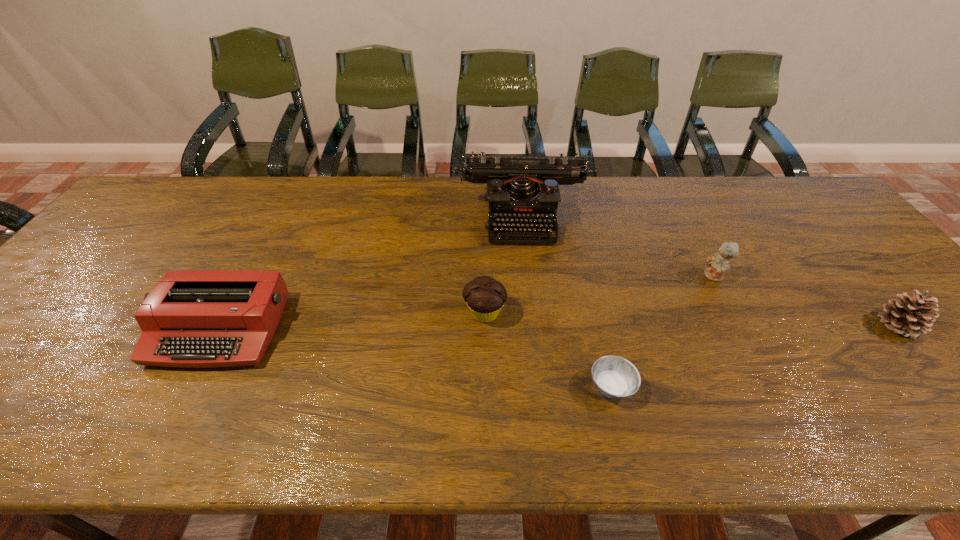
Find the location of a particular element. The width and height of the screenshot is (960, 540). the tallest object is located at coordinates (524, 190).

Locate an element on the screen. The image size is (960, 540). the taller typewriter is located at coordinates (524, 190).

Identify the location of the second farthest object. This screenshot has height=540, width=960. (718, 263).

Image resolution: width=960 pixels, height=540 pixels. I want to click on the fifth object from left to right, so click(x=718, y=263).

The image size is (960, 540). I want to click on pinecone, so click(x=910, y=316).

This screenshot has height=540, width=960. Find the location of `muffin`. muffin is located at coordinates (485, 296).

Find the location of `the nearer typewriter`. the nearer typewriter is located at coordinates (199, 318).

The height and width of the screenshot is (540, 960). What are the coordinates of `the leftmost object` in the screenshot? It's located at (199, 318).

Find the location of a particular element. The width and height of the screenshot is (960, 540). ashtray is located at coordinates click(614, 377).

At what (x,y) coordinates should I click in order to perform the action: click on free location located 0.080m on the keyboard of the right typewriter. Please return your answer as a coordinate pair (x, y). The width and height of the screenshot is (960, 540). Looking at the image, I should click on (530, 266).